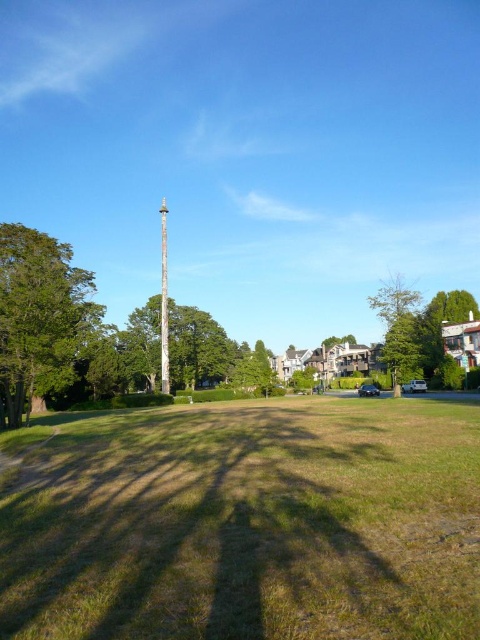
Can you confirm if smooth brown pole at center is positioned above smooth silver pole at center?

Incorrect, smooth brown pole at center is not positioned above smooth silver pole at center.

Can you confirm if smooth brown pole at center is shorter than smooth silver pole at center?

Yes, smooth brown pole at center is shorter than smooth silver pole at center.

The width and height of the screenshot is (480, 640). In order to click on smooth brown pole at center in this screenshot , I will do `click(197, 348)`.

Where is `smooth brown pole at center`? smooth brown pole at center is located at coordinates (197, 348).

Is point (188, 554) positioned behind point (29, 317)?

No, (188, 554) is closer to viewer.

Which is in front, point (135, 602) or point (41, 260)?

Point (135, 602)

Which is in front, point (317, 625) or point (52, 353)?

Positioned in front is point (317, 625).

The image size is (480, 640). I want to click on green grass at center, so click(x=250, y=524).

Does green grass at center appear on the left side of smooth brown pole at center?

In fact, green grass at center is to the right of smooth brown pole at center.

Which of these two, green grass at center or smooth brown pole at center, stands shorter?

green grass at center

Does point (369, 632) lie in front of point (220, 371)?

Yes, point (369, 632) is closer to viewer.

What are the coordinates of `green grass at center` in the screenshot? It's located at (250, 524).